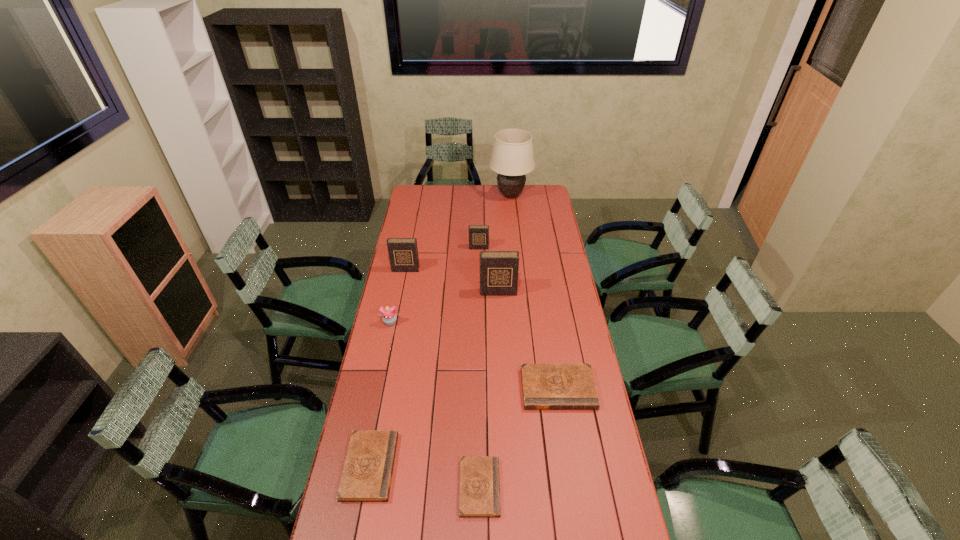
The height and width of the screenshot is (540, 960). In order to click on vacant space at the left edge of the desktop in this screenshot , I will do `click(392, 366)`.

The height and width of the screenshot is (540, 960). I want to click on free space at the right edge, so [577, 349].

Locate an element on the screen. The image size is (960, 540). blank region between the farthest brown diary and the smallest brown diary is located at coordinates (518, 437).

The width and height of the screenshot is (960, 540). I want to click on free space between the fifth nearest object and the farthest object, so click(504, 244).

Locate an element on the screen. vacant space that's between the seventh nearest object and the third nearest diary is located at coordinates (518, 318).

Image resolution: width=960 pixels, height=540 pixels. Find the location of `free space between the nearest dark diary and the shortest object`. free space between the nearest dark diary and the shortest object is located at coordinates (489, 389).

This screenshot has width=960, height=540. Identify the location of free spot between the smallest brown diary and the second smallest brown diary. (424, 477).

Identify the location of free point between the leftmost brown diary and the seventh shortest object. (434, 379).

At what (x,y) coordinates should I click in order to perform the action: click on vacant area that lies between the second brown diary from left to right and the second shortest object. Please return your answer as a coordinate pair (x, y). The width and height of the screenshot is (960, 540). Looking at the image, I should click on (424, 477).

Locate an element on the screen. The width and height of the screenshot is (960, 540). vacant region between the sixth tallest object and the farthest object is located at coordinates (535, 292).